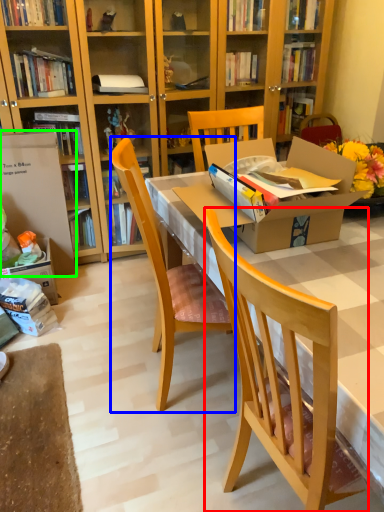
Question: Which object is positioned closest to chair (highlighted by a red box)? Select from chair (highlighted by a blue box) and box (highlighted by a green box).

Choices:
 (A) chair
 (B) box

Answer: (A)